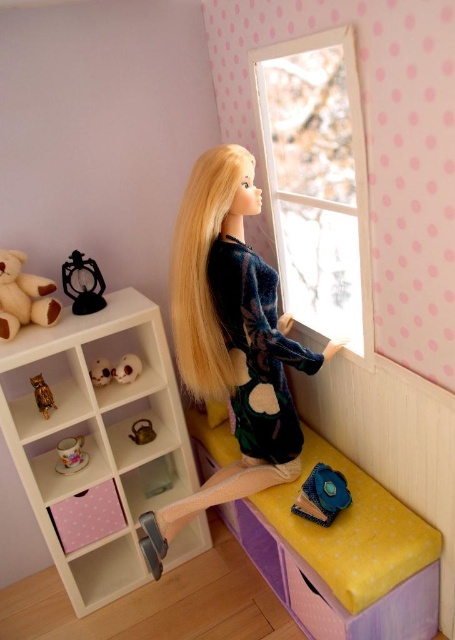
Between clear glass window at upper center and white plush toy at upper left, which one appears on the left side from the viewer's perspective?

white plush toy at upper left

How distant is clear glass window at upper center from white plush toy at upper left?

clear glass window at upper center is 93.70 centimeters from white plush toy at upper left.

Image resolution: width=455 pixels, height=640 pixels. Describe the element at coordinates (318, 180) in the screenshot. I see `clear glass window at upper center` at that location.

At what (x,y) coordinates should I click in order to perform the action: click on clear glass window at upper center. Please return your answer as a coordinate pair (x, y). This screenshot has height=640, width=455. Looking at the image, I should click on [318, 180].

Who is positioned more to the right, clear glass window at upper center or gold metallic teapot at lower left?

clear glass window at upper center

Who is more distant from viewer, (307, 88) or (132, 435)?

Positioned behind is point (132, 435).

Does point (298, 211) come behind point (146, 422)?

No, (298, 211) is in front of (146, 422).

Locate an element on the screen. The height and width of the screenshot is (640, 455). clear glass window at upper center is located at coordinates (318, 180).

Between blue fabric purse at lower center and gold metallic teapot at lower left, which one is positioned higher?

gold metallic teapot at lower left is above.

Which is behind, point (318, 467) or point (146, 435)?

The point (146, 435) is more distant.

You are a GUI agent. You are given a task and a screenshot of the screen. Output one action in this format:
    pyautogui.click(x=<x>, y=<y>)
    Task: Click on the blue fabric purse at lower center
    This screenshot has height=640, width=455.
    Given the screenshot: What is the action you would take?
    coord(322,496)